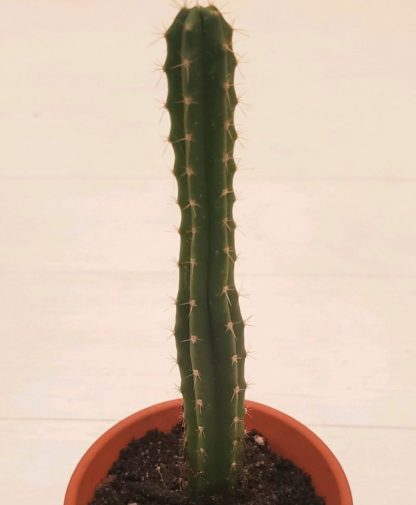
In order to click on background horizontal detail of wood slats in this screenshot , I will do `click(52, 419)`, `click(355, 424)`, `click(353, 274)`, `click(79, 272)`, `click(79, 178)`, `click(350, 179)`.